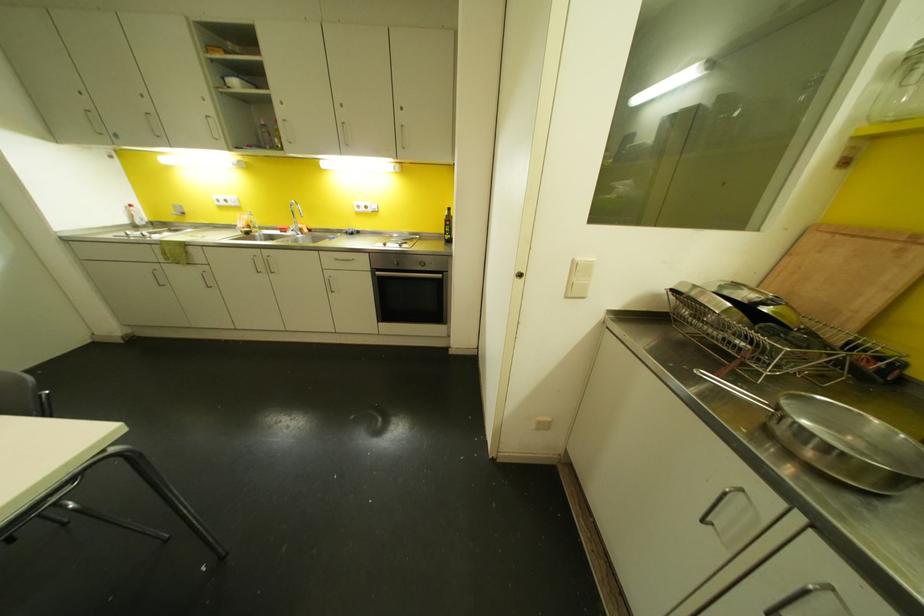
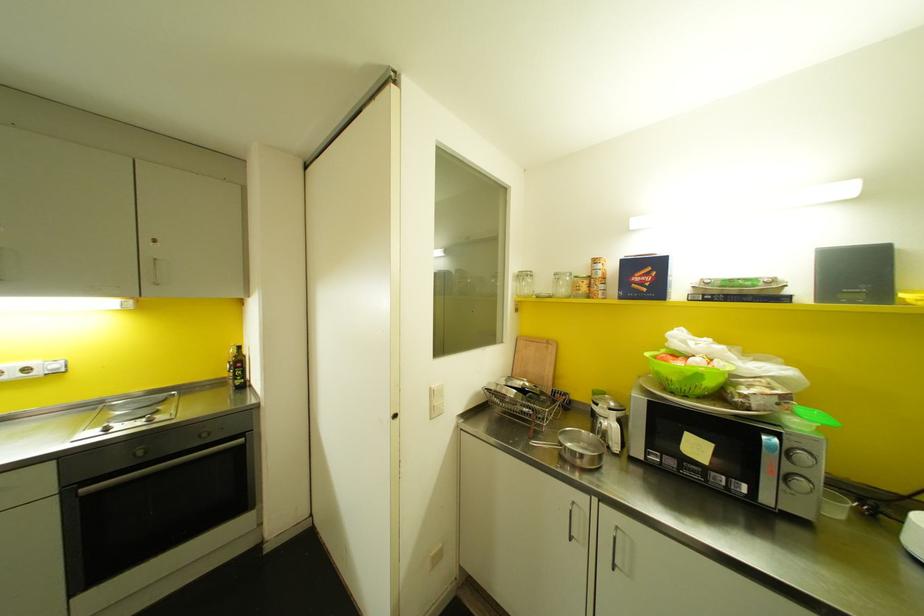
In the second image, find the point that corresponds to point 446,229 in the first image.

(237, 371)